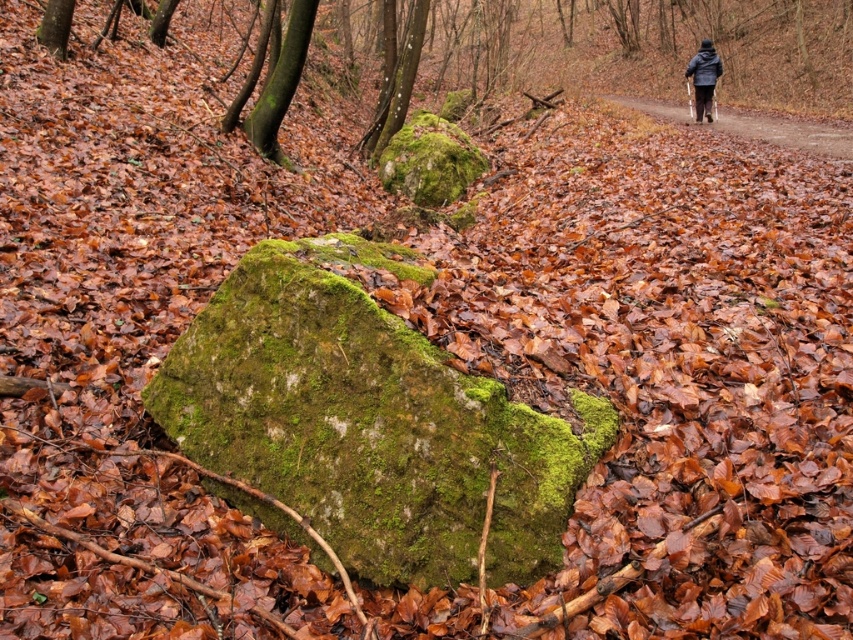
You are a hiker who wants to take a photo of the green mossy rock at center and the brown dirt path at center. Which object should you focus on first if you want to capture both in a single frame without moving the camera?

You should focus on the green mossy rock at center first because it is shorter than the brown dirt path at center, allowing both to be in the frame simultaneously.

You are a hiker trying to follow the narrow dirt path in the autumn forest. You notice the brown dirt path at center and the dark blue jacket at upper right. Which object is wider?

The brown dirt path at center is wider than the dark blue jacket at upper right according to the description.

You are planning to place a small decorative statue on the green mossy rock at center. Considering the size of the dark blue jacket at upper right, can you determine if the rock is wide enough to accommodate the statue?

The green mossy rock at center is wider than the dark blue jacket at upper right. Since the jacket is smaller than the rock, the statue should fit comfortably on the rock.